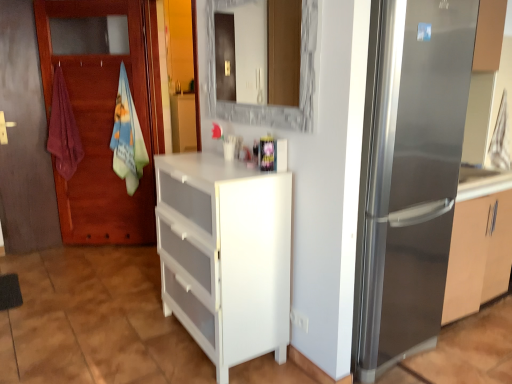
Question: From the image's perspective, is white plastic chest of drawers at center located above or below wooden door at left?

Choices:
 (A) above
 (B) below

Answer: (B)

Question: Relative to wooden door at left, is white plastic chest of drawers at center in front or behind?

Choices:
 (A) behind
 (B) front

Answer: (B)

Question: Which object is the closest to the satin silver refrigerator at right?

Choices:
 (A) maroon cotton towel at left, positioned as the first beach towel in left-to-right order
 (B) white plastic chest of drawers at center
 (C) wooden door at left
 (D) light blue cotton beach towel at left, the second beach towel in the left-to-right sequence

Answer: (B)

Question: Based on their relative distances, which object is nearer to the satin silver refrigerator at right?

Choices:
 (A) white plastic chest of drawers at center
 (B) wooden door at left
 (C) light blue cotton beach towel at left, the second beach towel in the left-to-right sequence
 (D) maroon cotton towel at left, positioned as the first beach towel in left-to-right order

Answer: (A)